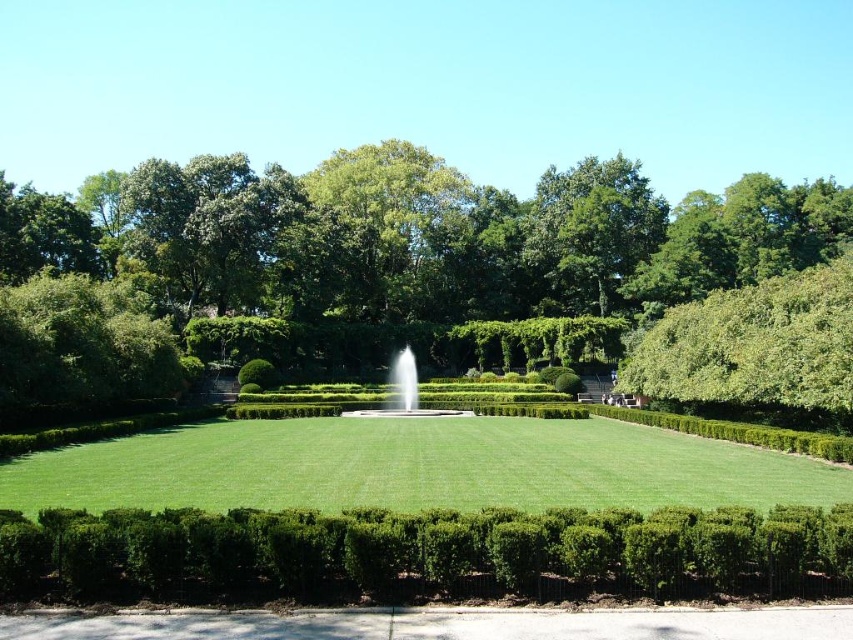
Question: Can you confirm if green lawn at center is wider than white marble fountain at center?

Choices:
 (A) no
 (B) yes

Answer: (B)

Question: Observing the image, what is the correct spatial positioning of green leafy hedge at center in reference to white marble fountain at center?

Choices:
 (A) above
 (B) below

Answer: (A)

Question: Which point appears closest to the camera in this image?

Choices:
 (A) (811, 589)
 (B) (399, 380)

Answer: (A)

Question: Which point is farther to the camera?

Choices:
 (A) (12, 576)
 (B) (712, 218)
 (C) (212, 433)
 (D) (392, 365)

Answer: (B)

Question: Which point is farther to the camera?

Choices:
 (A) (488, 589)
 (B) (463, 416)
 (C) (215, 244)

Answer: (C)

Question: Is the position of green lawn at center less distant than that of white marble fountain at center?

Choices:
 (A) no
 (B) yes

Answer: (B)